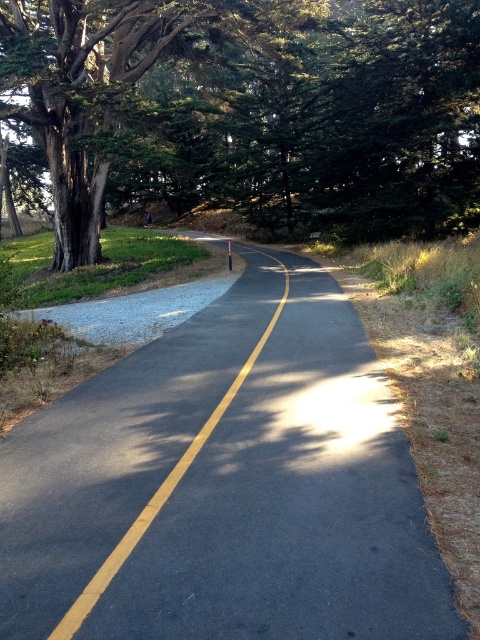
Who is higher up, black asphalt road at center or green leafy tree at left?

green leafy tree at left

Who is lower down, black asphalt road at center or green leafy tree at left?

black asphalt road at center is lower down.

Does point (432, 561) come behind point (224, 56)?

No, (432, 561) is in front of (224, 56).

Where is `black asphalt road at center`? This screenshot has height=640, width=480. black asphalt road at center is located at coordinates (225, 484).